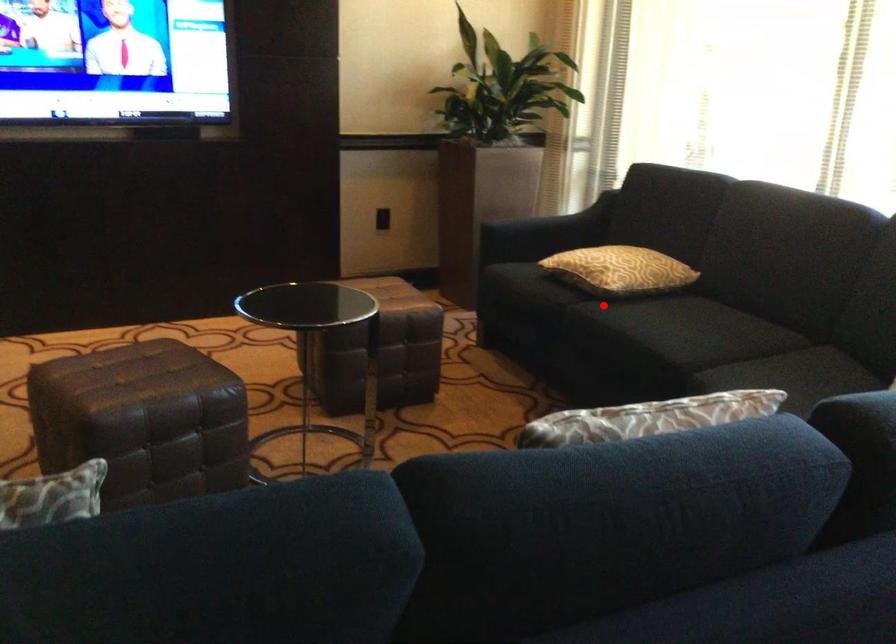
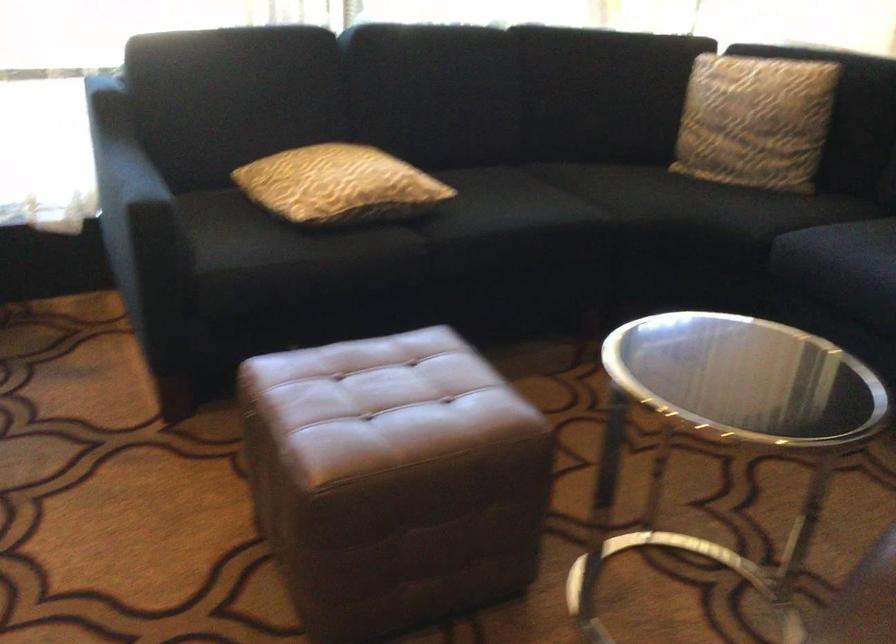
Locate, in the second image, the point that corresponds to the highlighted location in the first image.

(426, 227)